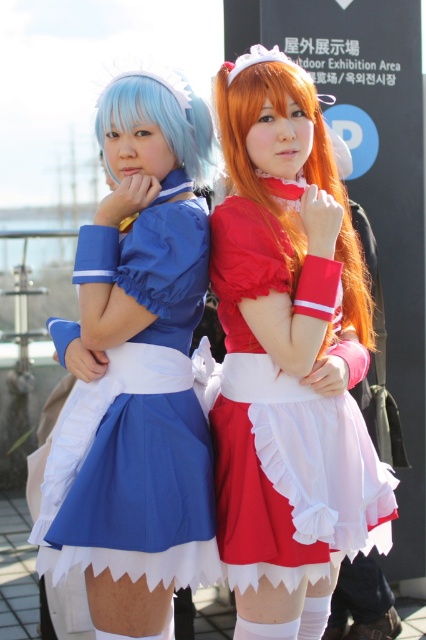
Which is in front, point (233, 144) or point (160, 122)?

Point (160, 122) is in front.

Which is in front, point (238, 93) or point (181, 161)?

Positioned in front is point (238, 93).

At what (x,y) coordinates should I click in order to perform the action: click on shiny orange wig at center. Please return your answer as a coordinate pair (x, y). This screenshot has width=426, height=640. Looking at the image, I should click on (304, 164).

Between matte blue fabric dress at left and matte blue wig at upper left, which one has more height?

Standing taller between the two is matte blue fabric dress at left.

Can you confirm if matte blue fabric dress at left is smaller than matte blue wig at upper left?

No.

Is point (80, 308) behind point (187, 138)?

Yes.

You are a GUI agent. You are given a task and a screenshot of the screen. Output one action in this format:
    pyautogui.click(x=<x>, y=<y>)
    Task: Click on the matte blue fabric dress at left
    
    Given the screenshot: What is the action you would take?
    pyautogui.click(x=143, y=227)

Consider the image. Is matte red dress at center further to camera compared to shiny orange wig at center?

No.

Consider the image. Who is more distant from viewer, (250, 572) or (325, 161)?

The point (325, 161) is more distant.

Between point (230, 212) and point (353, 301), which one is positioned behind?

Point (353, 301)

Identify the location of matte red dress at center. The image size is (426, 640). (282, 433).